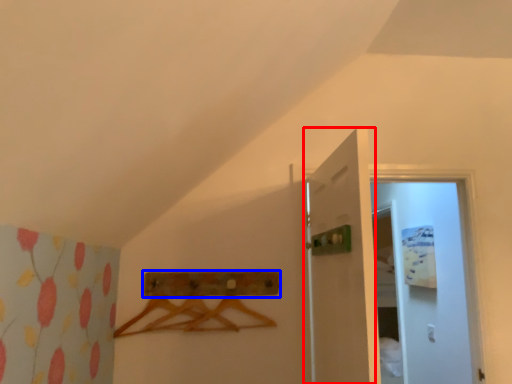
Question: Which object is closer to the camera taking this photo, door (highlighted by a red box) or drawer (highlighted by a blue box)?

Choices:
 (A) door
 (B) drawer

Answer: (A)